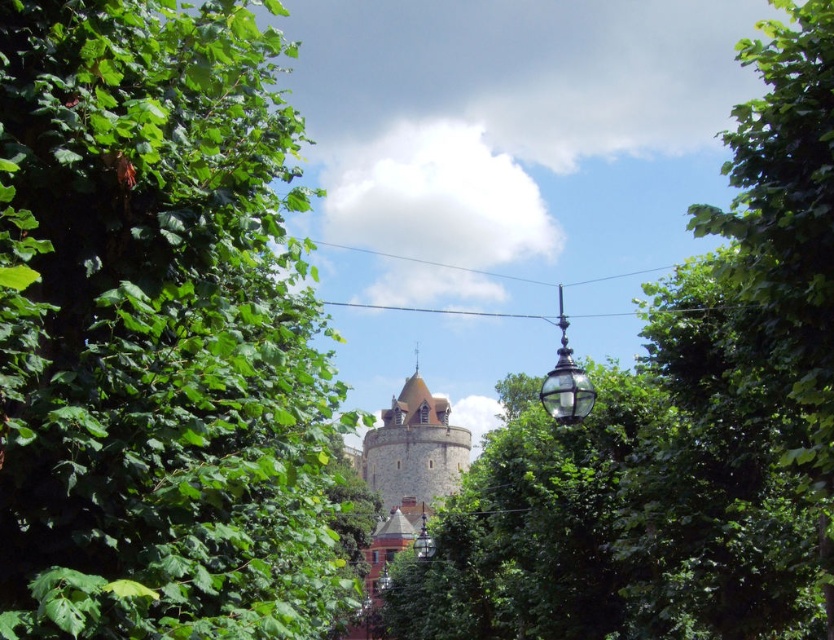
Question: Which point is closer to the camera?

Choices:
 (A) (488, 483)
 (B) (378, 433)
 (C) (104, 620)

Answer: (C)

Question: Does green leafy tree at center have a lesser width compared to stone tower at center?

Choices:
 (A) no
 (B) yes

Answer: (A)

Question: Based on their relative distances, which object is farther from the green leafy tree at left?

Choices:
 (A) stone tower at center
 (B) green leafy tree at center

Answer: (A)

Question: Which of these objects is positioned farthest from the green leafy tree at left?

Choices:
 (A) green leafy tree at center
 (B) stone tower at center

Answer: (B)

Question: Is green leafy tree at left to the right of green leafy tree at center from the viewer's perspective?

Choices:
 (A) no
 (B) yes

Answer: (A)

Question: Is green leafy tree at left smaller than stone tower at center?

Choices:
 (A) no
 (B) yes

Answer: (A)